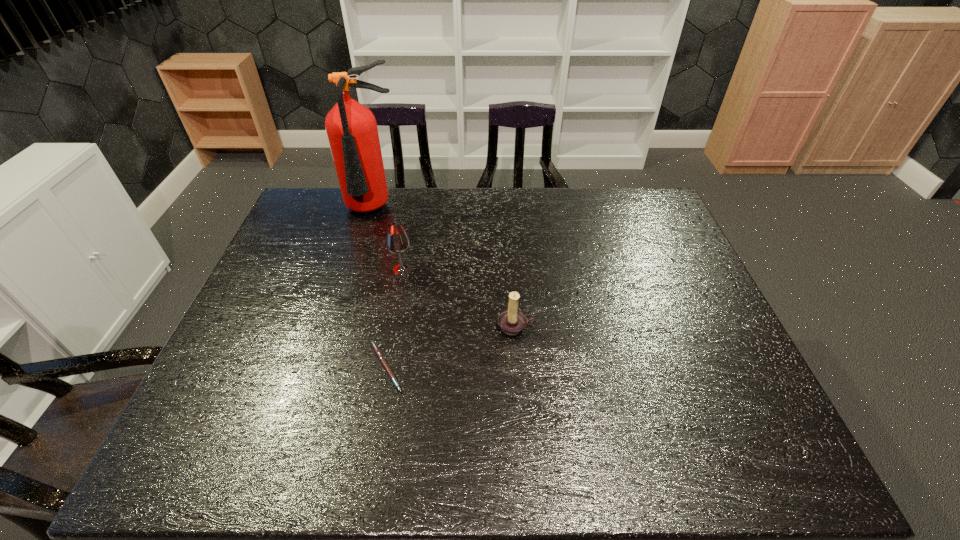
Identify which object is located as the nearest to the second shortest object. Please provide its 2D coordinates. Your answer should be formatted as a tuple, i.e. [(x, y)], where the tuple contains the x and y coordinates of a point satisfying the conditions above.

[(378, 353)]

The image size is (960, 540). Identify the location of vacant area in the image that satisfies the following two spatial constraints: 1. at the nozzle of the farthest object; 2. on the right side of the second farthest object. (356, 269).

I want to click on blank space that satisfies the following two spatial constraints: 1. at the nozzle of the wineglass; 2. on the right side of the fire extinguisher, so click(356, 269).

Where is `free spot that satisfies the following two spatial constraints: 1. at the nozzle of the farthest object; 2. on the left side of the third nearest object`? free spot that satisfies the following two spatial constraints: 1. at the nozzle of the farthest object; 2. on the left side of the third nearest object is located at coordinates (356, 269).

At what (x,y) coordinates should I click in order to perform the action: click on free space in the image that satisfies the following two spatial constraints: 1. at the nozzle of the fire extinguisher; 2. on the left side of the wineglass. Please return your answer as a coordinate pair (x, y). This screenshot has width=960, height=540. Looking at the image, I should click on (356, 269).

You are a GUI agent. You are given a task and a screenshot of the screen. Output one action in this format:
    pyautogui.click(x=<x>, y=<y>)
    Task: Click on the free location that satisfies the following two spatial constraints: 1. on the wick of the second nearest object; 2. at the nib of the pen
    
    Given the screenshot: What is the action you would take?
    pyautogui.click(x=519, y=367)